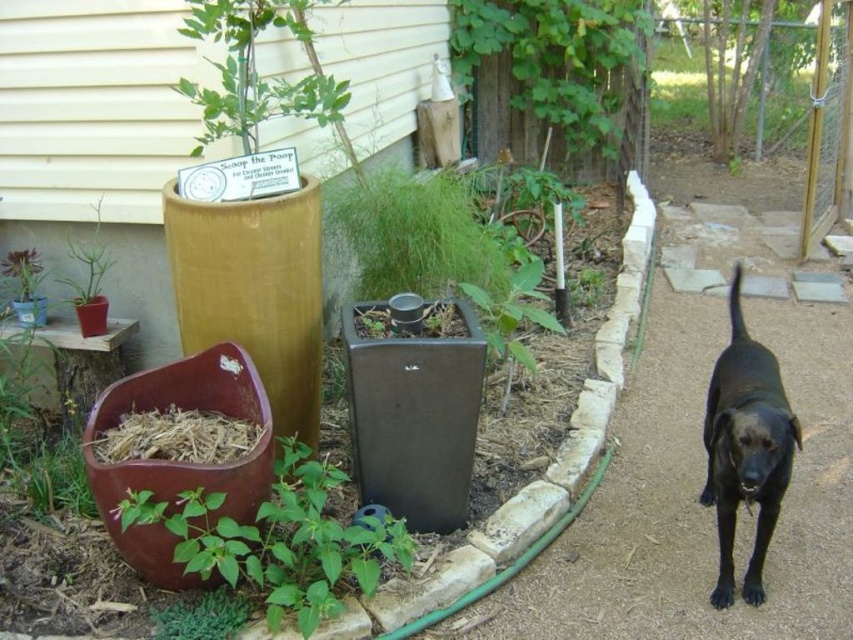
You are standing in the garden and want to place a new decoration exactly at the center of the garden. The garden is represented as a coordinate system where the bottom left corner is point 0,0 and the top right corner is point 1,1. Where should you place the decoration to be equidistant from the green leafy plant at upper center and the edge of the garden?

To place the decoration equidistant from the green leafy plant at upper center and the edge of the garden, calculate the midpoint between the plant and the nearest edge. The green leafy plant at upper center is at point (555, 65). The nearest edge would be the top edge at y coordinate 1. The midpoint between 0.652 and 1 is 0.826. Thus, the decoration should be placed at coordinates (704, 65).

You are a gardener who wants to place a new decorative item in the garden. You have a small statue that needs to be placed in front of the green leafy plant at upper center. Can you put it there without blocking the matte plastic pot at lower left?

The green leafy plant at upper center is positioned over the matte plastic pot at lower left, so placing the statue in front of the plant would block the pot. Choose another location.